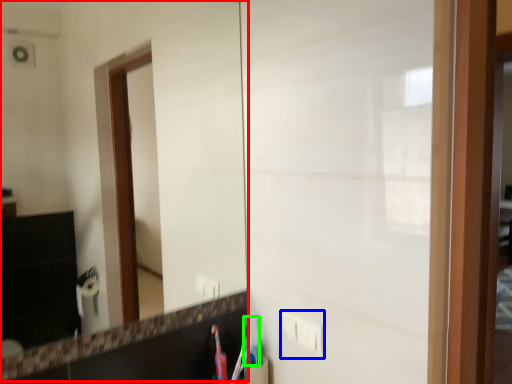
Question: Considering the real-world distances, which object is closest to mirror (highlighted by a red box)? electric outlet (highlighted by a blue box) or toothbrush (highlighted by a green box).

Choices:
 (A) electric outlet
 (B) toothbrush

Answer: (B)